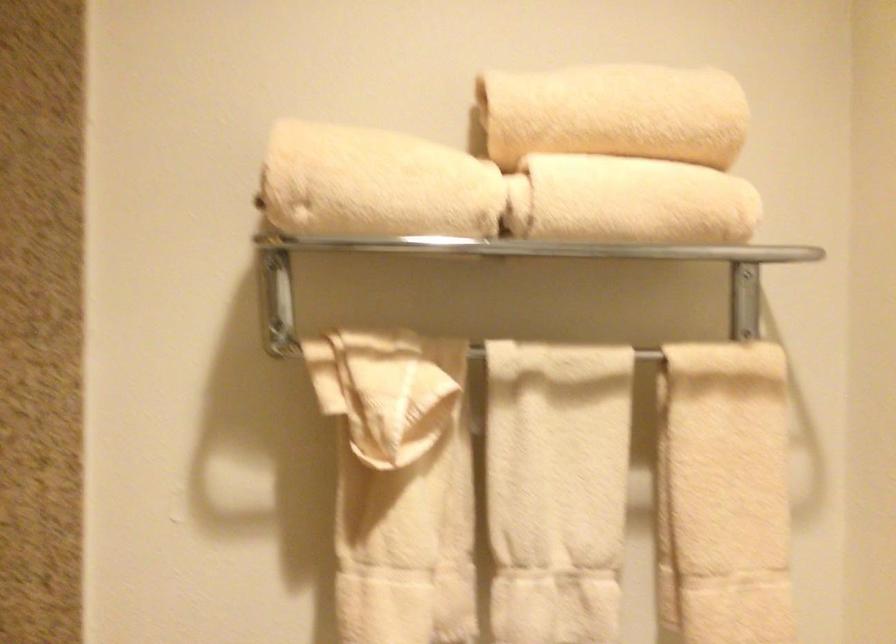
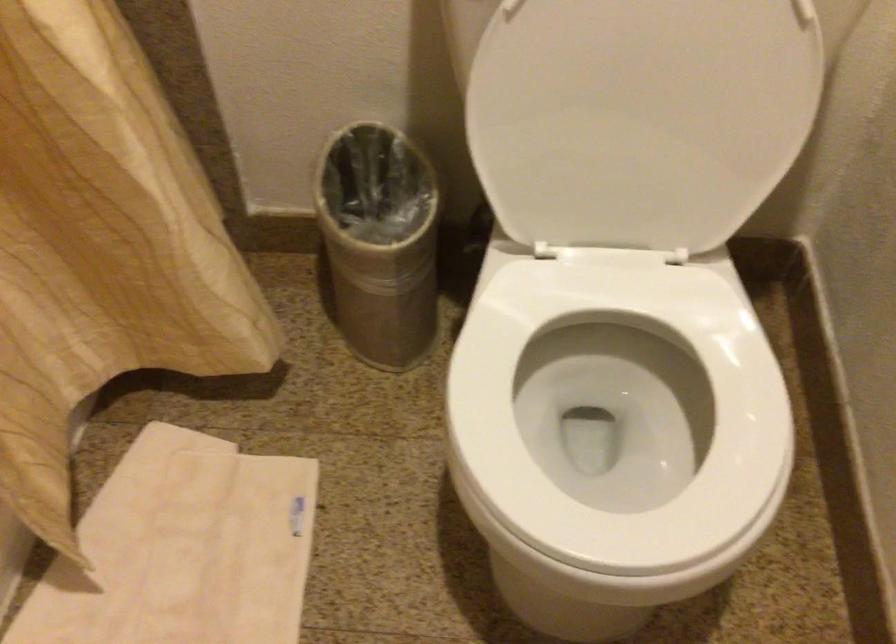
Question: The images are taken continuously from a first-person perspective. In which direction is your viewpoint rotating?

Choices:
 (A) Left
 (B) Right
 (C) Up
 (D) Down

Answer: (D)